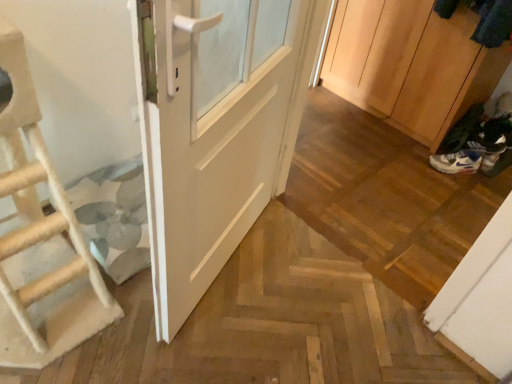
Image resolution: width=512 pixels, height=384 pixels. Identify the location of free space to the right of white mesh shoe at lower right. (489, 185).